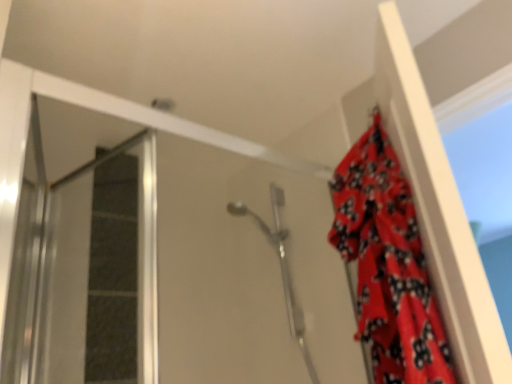
Question: Is satin silver shower head at center to the left of red fabric curtain at upper right from the viewer's perspective?

Choices:
 (A) no
 (B) yes

Answer: (B)

Question: Can you confirm if satin silver shower head at center is positioned to the right of red fabric curtain at upper right?

Choices:
 (A) no
 (B) yes

Answer: (A)

Question: From a real-world perspective, is satin silver shower head at center below red fabric curtain at upper right?

Choices:
 (A) no
 (B) yes

Answer: (A)

Question: Is satin silver shower head at center wider than red fabric curtain at upper right?

Choices:
 (A) yes
 (B) no

Answer: (A)

Question: Considering the relative sizes of satin silver shower head at center and red fabric curtain at upper right in the image provided, is satin silver shower head at center thinner than red fabric curtain at upper right?

Choices:
 (A) no
 (B) yes

Answer: (A)

Question: In terms of height, does transparent glass screen door at left look taller or shorter compared to red fabric curtain at upper right?

Choices:
 (A) short
 (B) tall

Answer: (A)

Question: From a real-world perspective, is transparent glass screen door at left positioned above or below red fabric curtain at upper right?

Choices:
 (A) below
 (B) above

Answer: (B)

Question: Is transparent glass screen door at left bigger or smaller than red fabric curtain at upper right?

Choices:
 (A) small
 (B) big

Answer: (A)

Question: Is transparent glass screen door at left to the left or to the right of red fabric curtain at upper right in the image?

Choices:
 (A) right
 (B) left

Answer: (B)

Question: Looking at their shapes, would you say red fabric curtain at upper right is wider or thinner than transparent glass screen door at left?

Choices:
 (A) thin
 (B) wide

Answer: (A)

Question: From the image's perspective, is red fabric curtain at upper right located above or below transparent glass screen door at left?

Choices:
 (A) above
 (B) below

Answer: (A)

Question: Visually, is red fabric curtain at upper right positioned to the left or to the right of transparent glass screen door at left?

Choices:
 (A) left
 (B) right

Answer: (B)

Question: From a real-world perspective, is red fabric curtain at upper right physically located above or below transparent glass screen door at left?

Choices:
 (A) below
 (B) above

Answer: (A)

Question: Is red fabric curtain at upper right inside the boundaries of satin silver shower head at center, or outside?

Choices:
 (A) inside
 (B) outside

Answer: (B)

Question: Is red fabric curtain at upper right to the left or to the right of satin silver shower head at center in the image?

Choices:
 (A) left
 (B) right

Answer: (B)